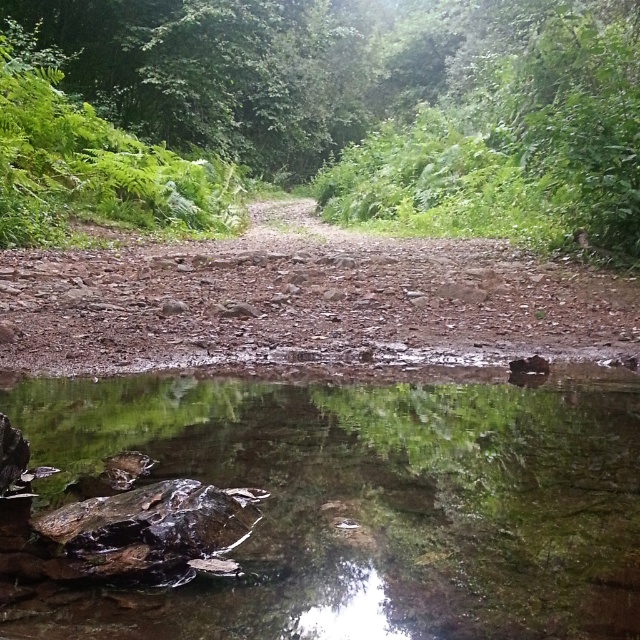
Does green leafy tree at center appear on the left side of dull brown gravel at center?

Indeed, green leafy tree at center is positioned on the left side of dull brown gravel at center.

Is point (100, 51) behind point (147, 362)?

Yes, it is.

Locate an element on the screen. green leafy tree at center is located at coordinates (376, 93).

Is clear water at center to the right of dull brown gravel at center from the viewer's perspective?

Indeed, clear water at center is positioned on the right side of dull brown gravel at center.

In the scene shown: Is clear water at center bigger than dull brown gravel at center?

No.

Describe the element at coordinates (355, 506) in the screenshot. I see `clear water at center` at that location.

Find the location of `clear water at center`. clear water at center is located at coordinates (355, 506).

Can you confirm if clear water at center is positioned to the right of green leafy tree at center?

Indeed, clear water at center is positioned on the right side of green leafy tree at center.

Where is `clear water at center`? clear water at center is located at coordinates (355, 506).

Identify the location of clear water at center. The height and width of the screenshot is (640, 640). (355, 506).